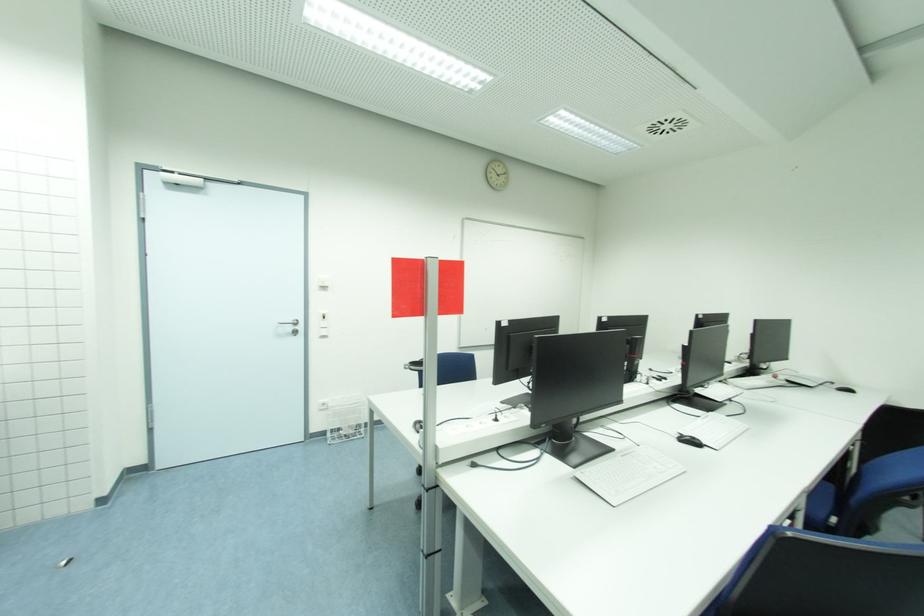
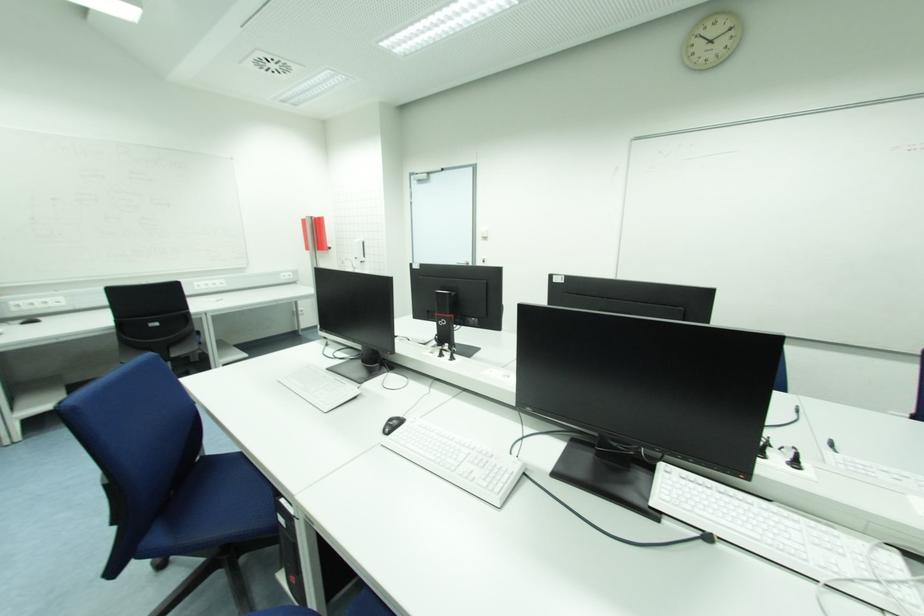
Find the pixel in the second image that matches pixel 637 453 in the first image.

(347, 386)